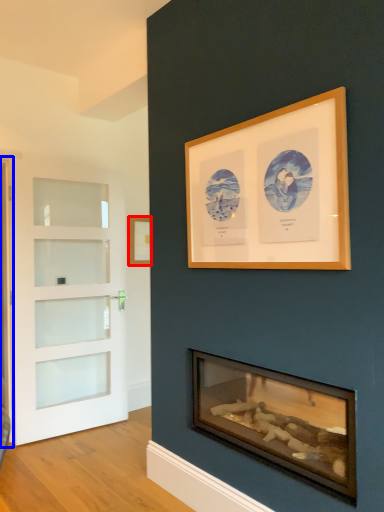
Question: Which of the following is the closest to the observer, picture frame (highlighted by a red box) or screen door (highlighted by a blue box)?

Choices:
 (A) picture frame
 (B) screen door

Answer: (B)